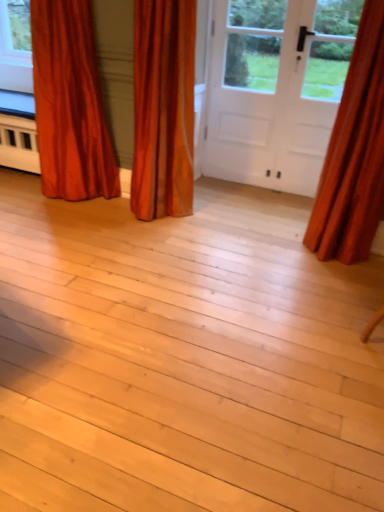
Locate an element on the screen. The height and width of the screenshot is (512, 384). vacant space situated on the left part of velvet orange curtain at left, which appears as the third curtain when viewed from the right is located at coordinates (21, 199).